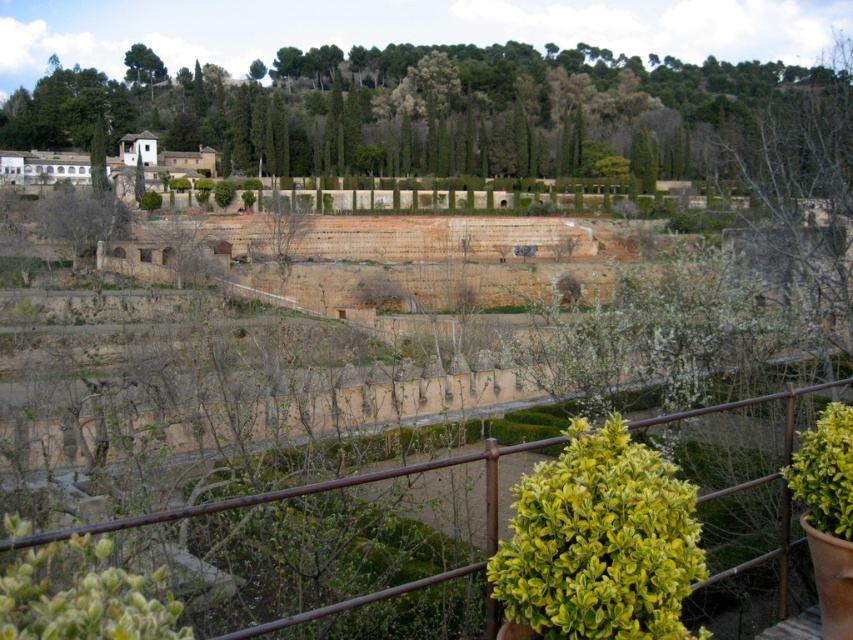
Is the position of brown metal fence at lower center more distant than that of green leafy tree at upper left?

No, it is not.

Between point (451, 461) and point (148, 56), which one is positioned in front?

Point (451, 461) is more forward.

Find the location of `brown metal fence at lower center`. brown metal fence at lower center is located at coordinates (280, 493).

Is green leafy tree at upper center further to camera compared to green leafy tree at upper left?

No, green leafy tree at upper center is closer to the viewer.

Is green leafy tree at upper center shorter than green leafy tree at upper left?

No, green leafy tree at upper center is not shorter than green leafy tree at upper left.

Does point (376, 83) come behind point (140, 67)?

No, (376, 83) is in front of (140, 67).

Identify the location of green leafy tree at upper center. (424, 109).

Is green leafy tree at upper center thinner than brown metal fence at lower center?

No.

Identify the location of green leafy tree at upper center. This screenshot has height=640, width=853. (424, 109).

Is point (544, 138) positioned behind point (784, 432)?

Yes, point (544, 138) is farther from viewer.

Where is `green leafy tree at upper center`? green leafy tree at upper center is located at coordinates (424, 109).